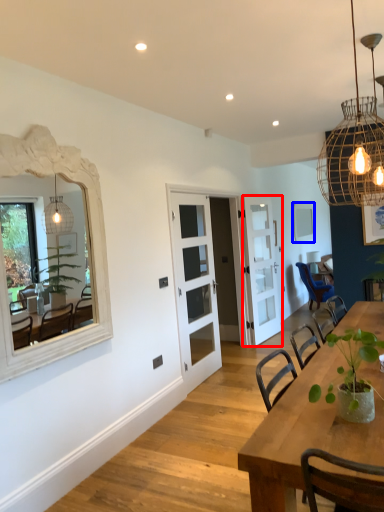
Question: Among these objects, which one is nearest to the camera, door (highlighted by a red box) or mirror (highlighted by a blue box)?

Choices:
 (A) door
 (B) mirror

Answer: (A)